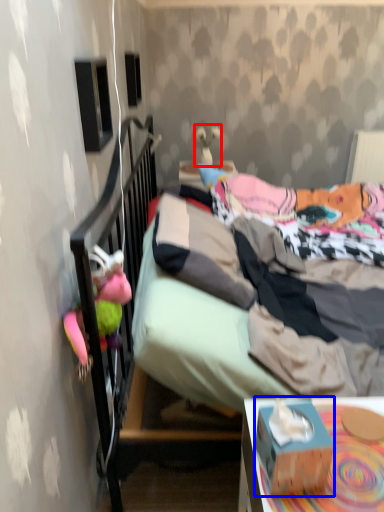
Question: Which object is further to the camera taking this photo, toy (highlighted by a red box) or box (highlighted by a blue box)?

Choices:
 (A) toy
 (B) box

Answer: (A)